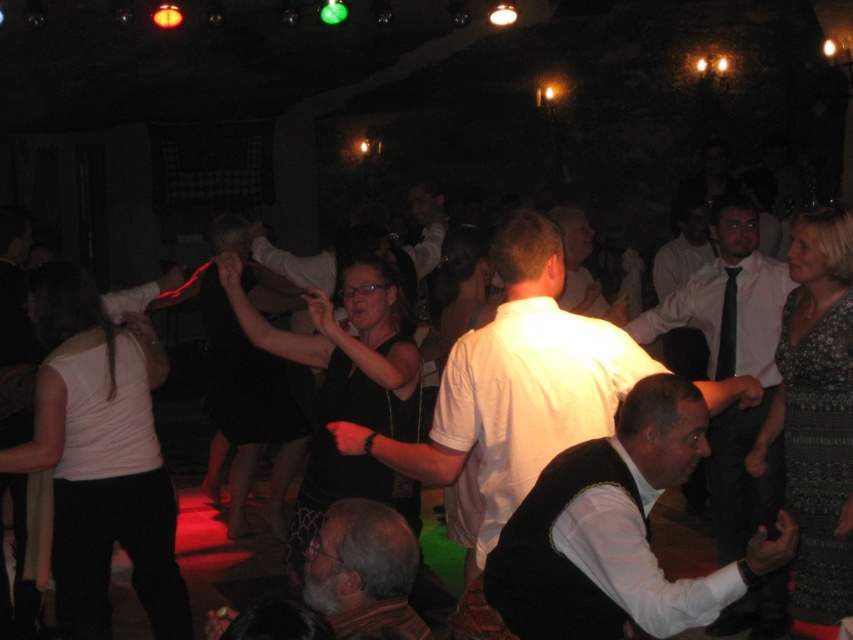
Question: Which of these objects is positioned closest to the black silk tie at center?

Choices:
 (A) white shirt at center
 (B) white matte vest at center

Answer: (A)

Question: Which object appears closest to the camera in this image?

Choices:
 (A) white shirt at center
 (B) black silk tie at center
 (C) white matte shirt at center
 (D) white matte vest at center

Answer: (D)

Question: Which object is the closest to the white shirt at center?

Choices:
 (A) gray hair at lower center
 (B) white matte shirt at center

Answer: (B)

Question: Can you confirm if white matte vest at center is smaller than white matte shirt at center?

Choices:
 (A) no
 (B) yes

Answer: (B)

Question: Is white matte shirt at center bigger than gray hair at lower center?

Choices:
 (A) no
 (B) yes

Answer: (B)

Question: Observing the image, what is the correct spatial positioning of white shirt at center in reference to black silk tie at center?

Choices:
 (A) left
 (B) right

Answer: (A)